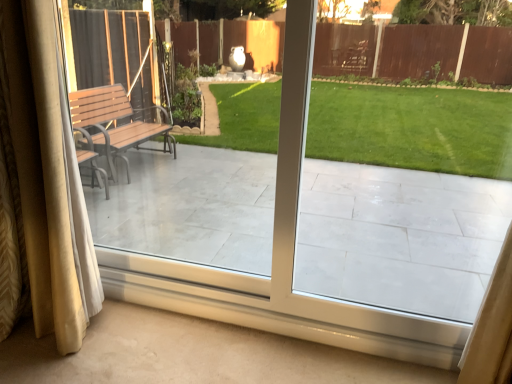
Question: Is silky beige curtains at left taller or shorter than white tile porch at center?

Choices:
 (A) tall
 (B) short

Answer: (A)

Question: In the image, is silky beige curtains at left positioned in front of or behind white tile porch at center?

Choices:
 (A) behind
 (B) front

Answer: (A)

Question: Is silky beige curtains at left wider or thinner than white tile porch at center?

Choices:
 (A) thin
 (B) wide

Answer: (B)

Question: In the image, is white tile porch at center on the left side or the right side of silky beige curtains at left?

Choices:
 (A) left
 (B) right

Answer: (B)

Question: From their relative heights in the image, would you say white tile porch at center is taller or shorter than silky beige curtains at left?

Choices:
 (A) short
 (B) tall

Answer: (A)

Question: Considering the positions of white tile porch at center and silky beige curtains at left in the image, is white tile porch at center wider or thinner than silky beige curtains at left?

Choices:
 (A) wide
 (B) thin

Answer: (B)

Question: Relative to silky beige curtains at left, is white tile porch at center in front or behind?

Choices:
 (A) behind
 (B) front

Answer: (B)